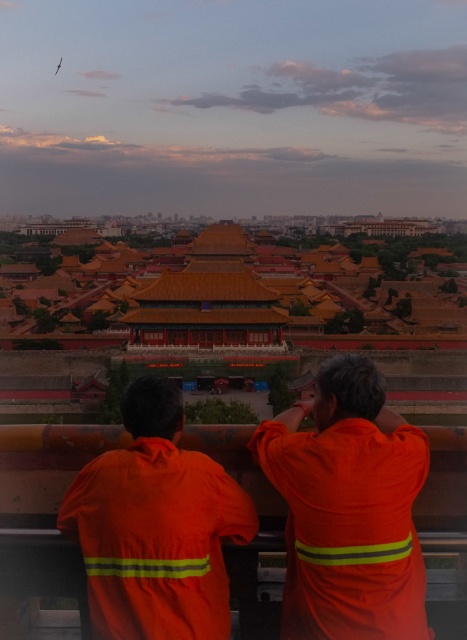
Question: Which of the following is the closest to the observer?

Choices:
 (A) orange fabric jacket at lower center
 (B) orange fabric jacket at center

Answer: (A)

Question: In this image, where is orange fabric jacket at center located relative to orange fabric jacket at lower center?

Choices:
 (A) right
 (B) left

Answer: (A)

Question: Does orange fabric jacket at center have a lesser width compared to orange fabric jacket at lower center?

Choices:
 (A) no
 (B) yes

Answer: (B)

Question: Is orange fabric jacket at center wider than orange fabric jacket at lower center?

Choices:
 (A) no
 (B) yes

Answer: (A)

Question: Which of the following is the closest to the observer?

Choices:
 (A) orange fabric jacket at center
 (B) orange fabric jacket at lower center

Answer: (B)